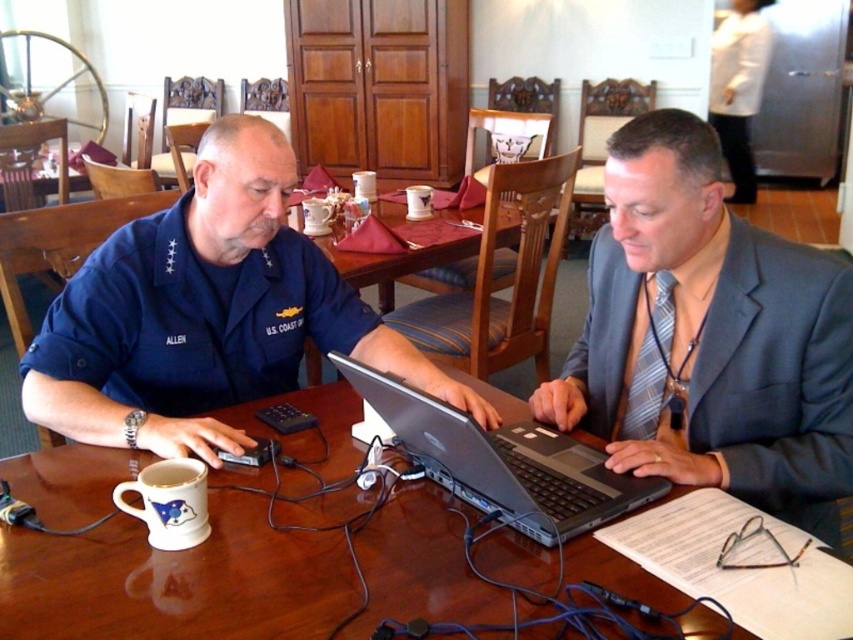
Question: Which of the following is the farthest from the observer?

Choices:
 (A) (485, 460)
 (B) (184, 493)
 (C) (756, 504)

Answer: (C)

Question: Is navy blue uniform at center above white ceramic mug at lower left?

Choices:
 (A) yes
 (B) no

Answer: (A)

Question: Based on their relative distances, which object is nearer to the striped fabric tie at center?

Choices:
 (A) navy blue uniform at center
 (B) white ceramic mug at lower left

Answer: (A)

Question: Which object is the farthest from the gray suit at center?

Choices:
 (A) silver/black laptop at center
 (B) striped fabric tie at center
 (C) wooden table at center
 (D) brown wooden table at center

Answer: (C)

Question: Is brown wooden table at center to the right of navy blue uniform at center from the viewer's perspective?

Choices:
 (A) yes
 (B) no

Answer: (A)

Question: Is the position of gray suit at center less distant than that of silver/black laptop at center?

Choices:
 (A) no
 (B) yes

Answer: (A)